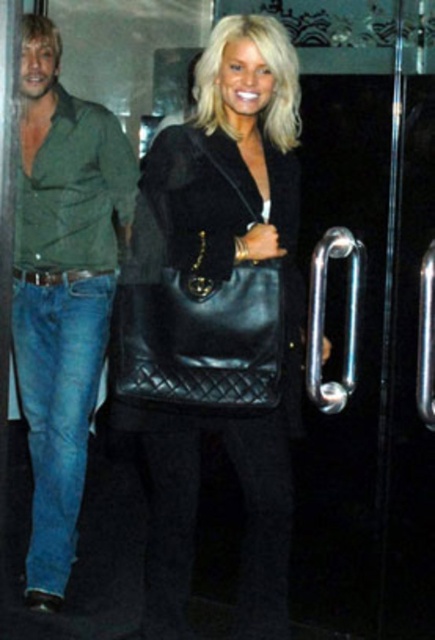
Question: Is black leather bag at center to the left of black leather handbag at center from the viewer's perspective?

Choices:
 (A) yes
 (B) no

Answer: (B)

Question: Can you confirm if black leather handbag at center is positioned above blue denim jeans at left?

Choices:
 (A) no
 (B) yes

Answer: (B)

Question: Which is farther from the blue denim jeans at left?

Choices:
 (A) black leather bag at center
 (B) black leather handbag at center
 (C) green denim jeans at left

Answer: (A)

Question: Can you confirm if black leather bag at center is bigger than blue denim jeans at left?

Choices:
 (A) no
 (B) yes

Answer: (B)

Question: Which of the following is the farthest from the observer?

Choices:
 (A) (32, 369)
 (B) (46, 337)

Answer: (B)

Question: Which object appears farthest from the camera in this image?

Choices:
 (A) green denim jeans at left
 (B) black leather bag at center
 (C) blue denim jeans at left

Answer: (C)